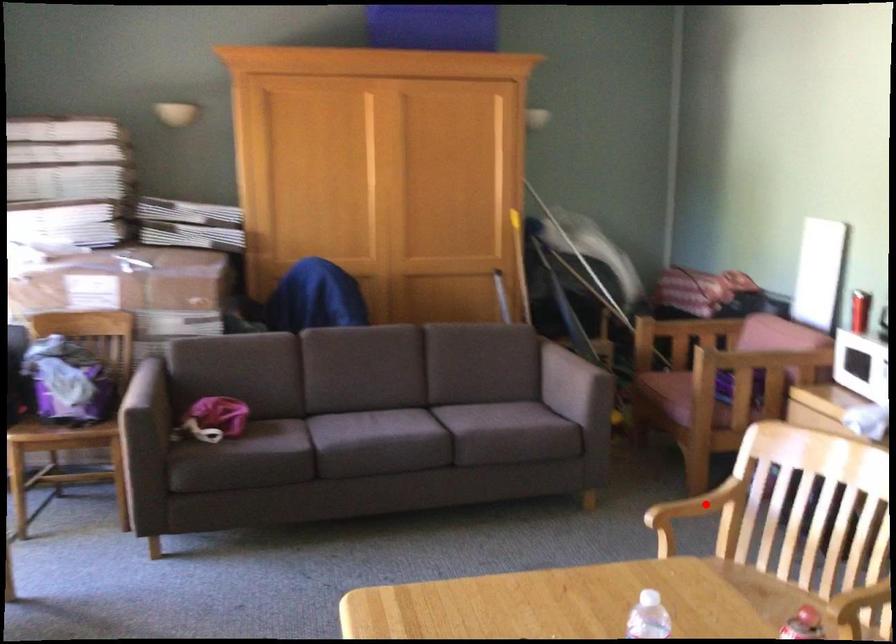
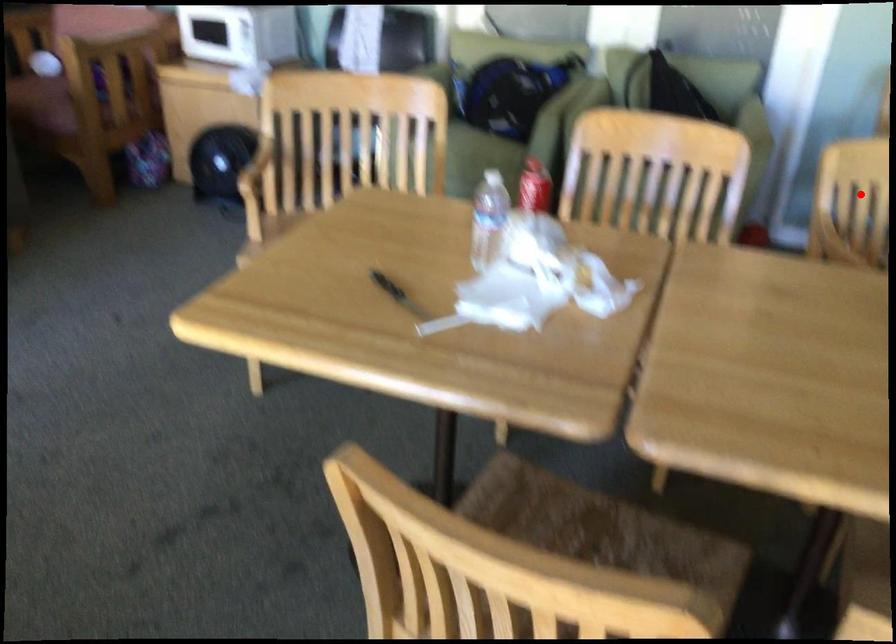
I am providing you with two images of the same scene from different viewpoints. A red point is marked on the first image and another point is marked on the second image. Do the highlighted points in image1 and image2 indicate the same real-world spot?

No